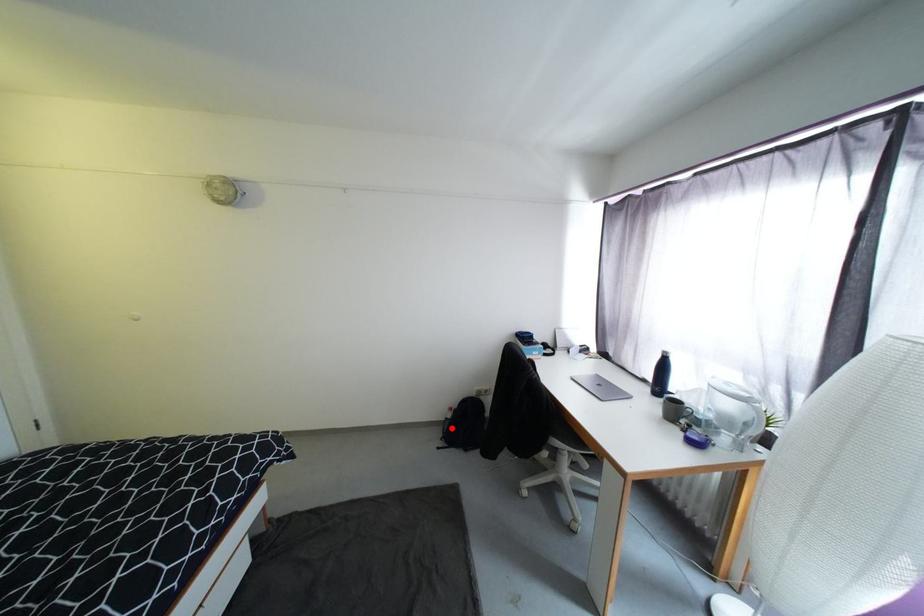
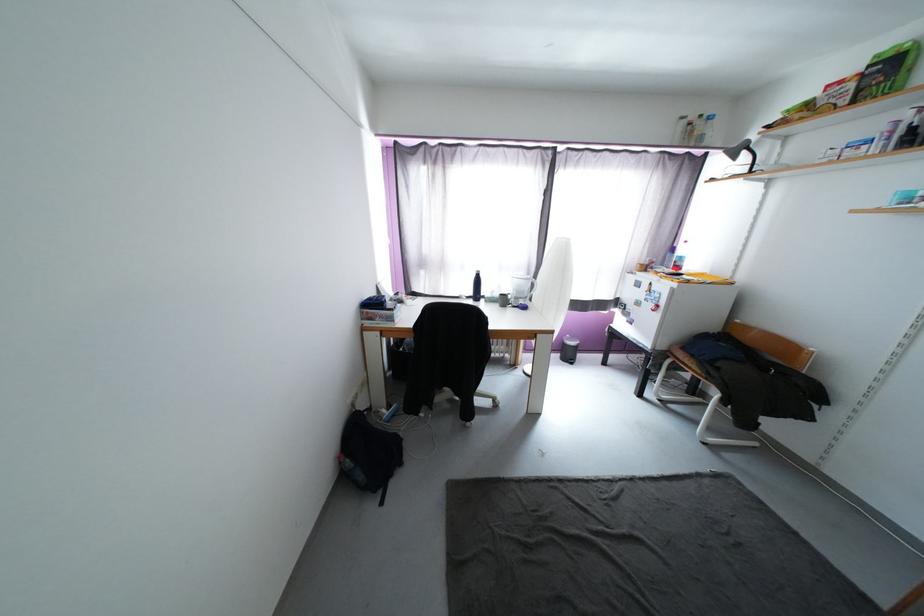
In the second image, find the point that corresponds to the highlighted location in the first image.

(367, 479)